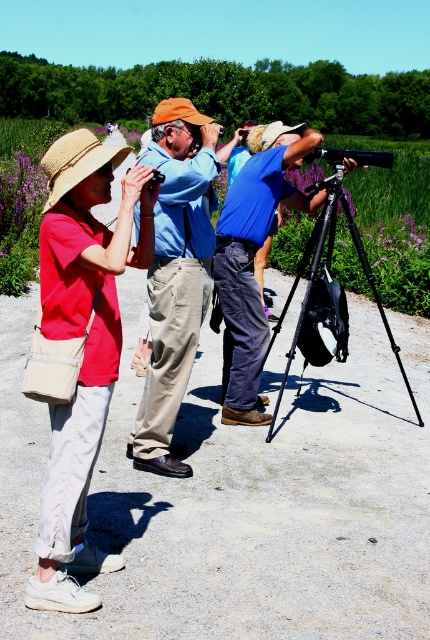
In the scene of people birdwatching, where exactly is the matte blue shirt at center located in terms of coordinates?

The matte blue shirt at center is located at coordinates point (175, 275).

You are a photographer trying to capture both the matte blue shirt at center and the blue fabric shirt at center in a single frame. Which one should you focus on first to ensure it appears in focus?

The matte blue shirt at center is above the blue fabric shirt at center, so you should focus on the matte blue shirt at center first to ensure it appears in focus.

You are standing in the birdwatching area and want to take a photo of two points marked in the scene. The first point is at coordinates point (76, 572) and the second point is at point (218, 276). Which point is closer to you?

Point (76, 572) is closer to the camera than point (218, 276).